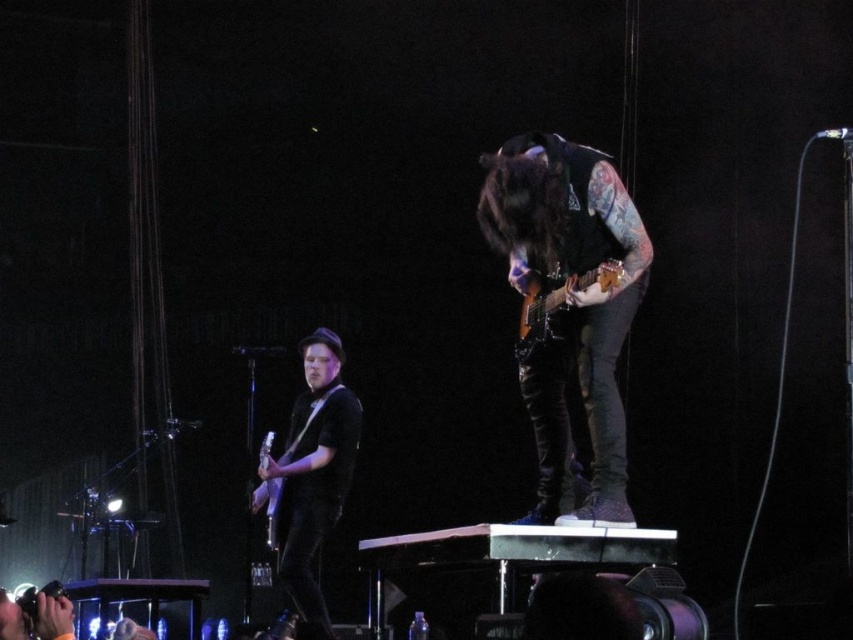
In the scene shown: Which of these two, shiny black guitar at center or shiny brown electric guitar at center, stands taller?

shiny black guitar at center

Based on the photo, does shiny black guitar at center appear over shiny brown electric guitar at center?

Incorrect, shiny black guitar at center is not positioned above shiny brown electric guitar at center.

Image resolution: width=853 pixels, height=640 pixels. I want to click on shiny black guitar at center, so click(570, 305).

Locate an element on the screen. This screenshot has width=853, height=640. shiny black guitar at center is located at coordinates (570, 305).

Can you confirm if matte black guitar at left is smaller than matte silver guitar at center?

No.

Measure the distance between matte black guitar at left and camera.

The distance of matte black guitar at left from camera is 4.48 meters.

At what (x,y) coordinates should I click in order to perform the action: click on matte black guitar at left. Please return your answer as a coordinate pair (x, y). Looking at the image, I should click on (311, 476).

Locate an element on the screen. This screenshot has width=853, height=640. matte black guitar at left is located at coordinates (311, 476).

Between point (314, 566) and point (532, 300), which one is positioned in front?

Positioned in front is point (532, 300).

Where is `matte black guitar at left`? This screenshot has height=640, width=853. matte black guitar at left is located at coordinates (311, 476).